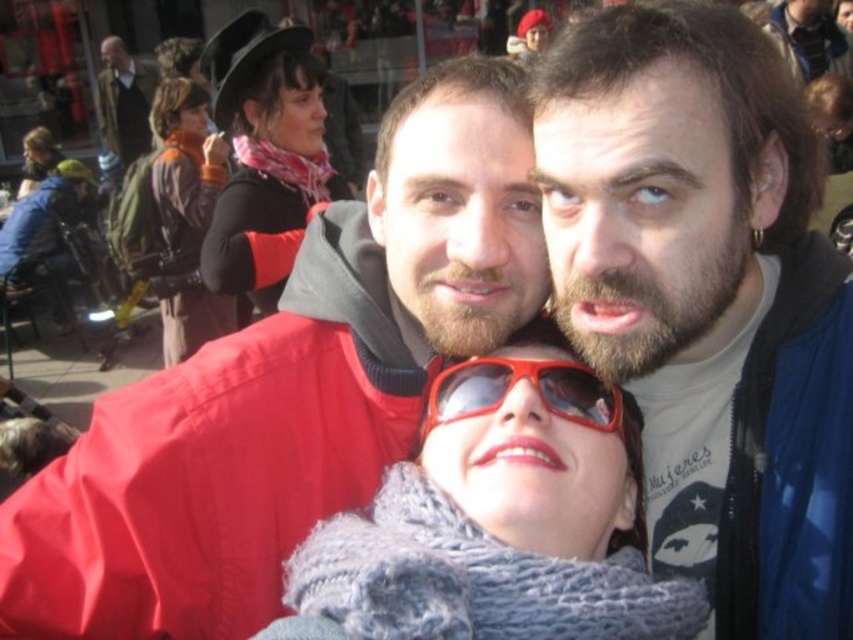
You are taking a photo of the matte blue jacket at upper right and the matte pink scarf at upper left. To frame both in the shot, should you adjust your camera to the left or right?

The matte blue jacket at upper right is to the right of the matte pink scarf at upper left, so to frame both in the shot, you should adjust your camera to the left to include both objects in the frame.

You are designing a display case for a clothing store and need to arrange the matte blue jacket at upper right and the matte pink scarf at upper left. Based on their sizes, which item should be placed first to ensure they both fit in the 1.2 meter wide display area?

The matte blue jacket at upper right is wider than the matte pink scarf at upper left. To fit both items in the 1.2 meter wide display area, place the wider matte blue jacket at upper right first, then the narrower matte pink scarf at upper left. This arrangement ensures optimal space utilization.